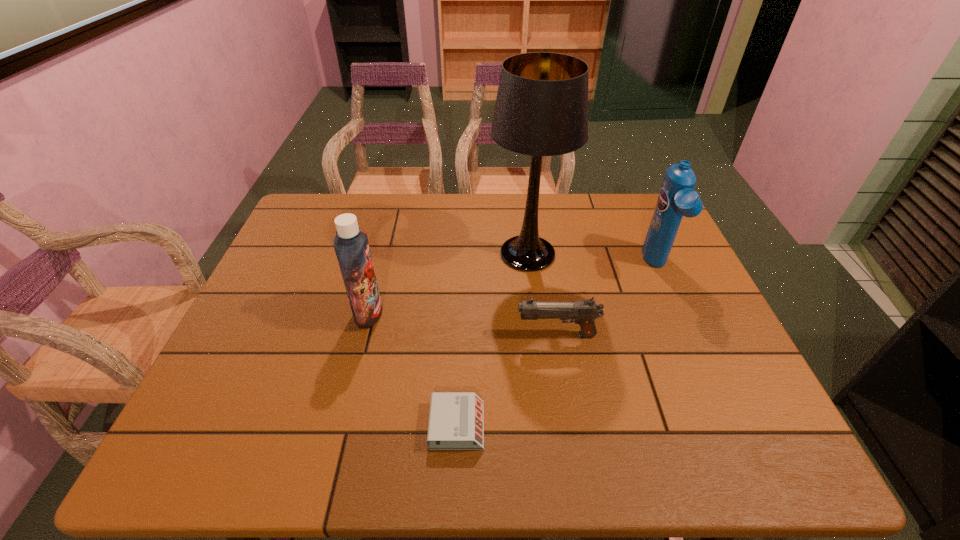
Image resolution: width=960 pixels, height=540 pixels. What are the coordinates of `free location located 0.350m on the front label of the leftmost object` in the screenshot? It's located at (518, 313).

The width and height of the screenshot is (960, 540). I want to click on blank area located 0.070m in the direction the fourth tallest object is aimed, so click(x=488, y=335).

At what (x,y) coordinates should I click in order to perform the action: click on free space located in the direction the fourth tallest object is aimed. Please return your answer as a coordinate pair (x, y). Image resolution: width=960 pixels, height=540 pixels. Looking at the image, I should click on coord(475,335).

At what (x,y) coordinates should I click in order to perform the action: click on free spot located in the direction the fourth tallest object is aimed. Please return your answer as a coordinate pair (x, y). The width and height of the screenshot is (960, 540). Looking at the image, I should click on (443, 335).

Find the location of `free space located on the left of the second object from left to right`. free space located on the left of the second object from left to right is located at coordinates (362, 425).

At what (x,y) coordinates should I click in order to perform the action: click on object that is at the far edge. Please return your answer as a coordinate pair (x, y). The height and width of the screenshot is (540, 960). Looking at the image, I should click on (541, 109).

The image size is (960, 540). Find the location of `object situated at the near edge`. object situated at the near edge is located at coordinates (456, 421).

You are a GUI agent. You are given a task and a screenshot of the screen. Output one action in this format:
    pyautogui.click(x=<x>, y=<y>)
    Task: Click on the object that is at the right edge
    Image resolution: width=960 pixels, height=540 pixels.
    Given the screenshot: What is the action you would take?
    pyautogui.click(x=676, y=199)

In the image, there is a desktop. At what (x,y) coordinates should I click in order to perform the action: click on vacant space at the far edge. Please return your answer as a coordinate pair (x, y). The width and height of the screenshot is (960, 540). Looking at the image, I should click on (602, 234).

What are the coordinates of `free location at the near edge of the desktop` in the screenshot? It's located at (424, 442).